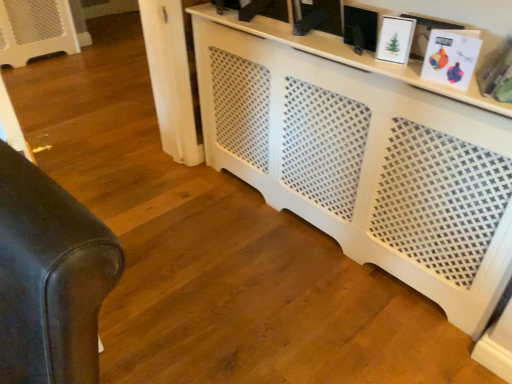
Question: Is white perforated cabinet at center facing towards matte black picture frame at upper center, which is the 1th picture frame in left-to-right order?

Choices:
 (A) yes
 (B) no

Answer: (B)

Question: From a real-world perspective, is white perforated cabinet at center physically above matte black picture frame at upper center, which appears as the third picture frame when viewed from the right?

Choices:
 (A) no
 (B) yes

Answer: (A)

Question: Would you say white perforated cabinet at center is outside matte black picture frame at upper center, which appears as the third picture frame when viewed from the right?

Choices:
 (A) yes
 (B) no

Answer: (A)

Question: Does white perforated cabinet at center appear on the left side of matte black picture frame at upper center, which is the 1th picture frame in left-to-right order?

Choices:
 (A) yes
 (B) no

Answer: (A)

Question: Considering the relative sizes of white perforated cabinet at center and matte black picture frame at upper center, which is the 1th picture frame in left-to-right order, in the image provided, is white perforated cabinet at center smaller than matte black picture frame at upper center, which is the 1th picture frame in left-to-right order,?

Choices:
 (A) no
 (B) yes

Answer: (A)

Question: Would you say leather couch at left is to the left or to the right of white matte picture frame at upper right, the third picture frame from the left, in the picture?

Choices:
 (A) left
 (B) right

Answer: (A)

Question: From their relative heights in the image, would you say leather couch at left is taller or shorter than white matte picture frame at upper right, the third picture frame from the left?

Choices:
 (A) tall
 (B) short

Answer: (A)

Question: From the image's perspective, is leather couch at left above or below white matte picture frame at upper right, placed as the 1th picture frame when sorted from right to left?

Choices:
 (A) below
 (B) above

Answer: (A)

Question: Is leather couch at left wider or thinner than white matte picture frame at upper right, the third picture frame from the left?

Choices:
 (A) thin
 (B) wide

Answer: (B)

Question: In terms of width, does white perforated cabinet at center look wider or thinner when compared to white matte picture frame at upper right, the third picture frame from the left?

Choices:
 (A) wide
 (B) thin

Answer: (A)

Question: Choose the correct answer: Is white perforated cabinet at center inside white matte picture frame at upper right, the third picture frame from the left, or outside it?

Choices:
 (A) outside
 (B) inside

Answer: (A)

Question: In terms of size, does white perforated cabinet at center appear bigger or smaller than white matte picture frame at upper right, the third picture frame from the left?

Choices:
 (A) small
 (B) big

Answer: (B)

Question: Considering the positions of point (396, 86) and point (462, 57), is point (396, 86) closer or farther from the camera than point (462, 57)?

Choices:
 (A) farther
 (B) closer

Answer: (A)

Question: Choose the correct answer: Is matte black picture frame at upper center, which appears as the third picture frame when viewed from the right, inside white perforated cabinet at center or outside it?

Choices:
 (A) inside
 (B) outside

Answer: (B)

Question: In the image, is matte black picture frame at upper center, which appears as the third picture frame when viewed from the right, on the left side or the right side of white perforated cabinet at center?

Choices:
 (A) right
 (B) left

Answer: (A)